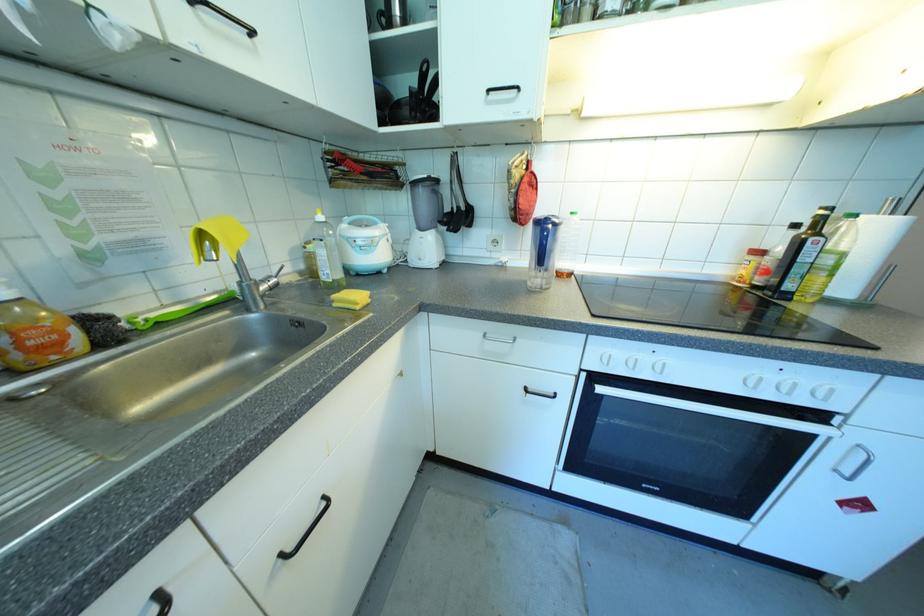
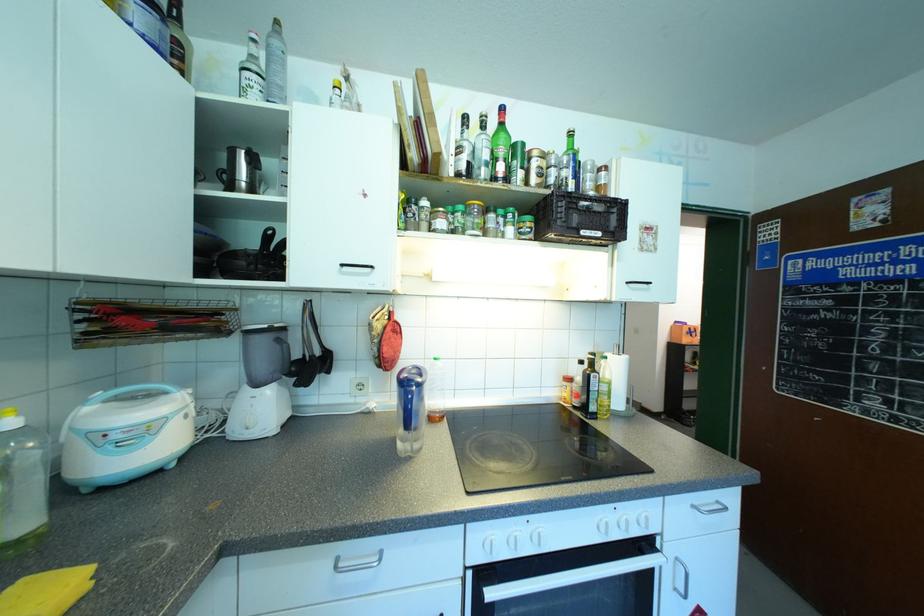
Find the pixel in the second image that matches [835,469] in the first image.

(675, 589)